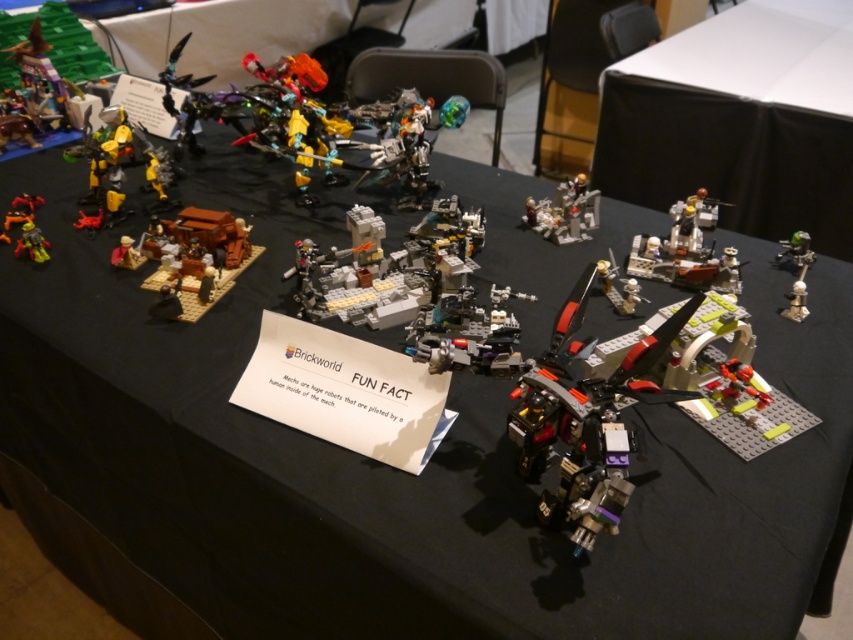
Question: Can you confirm if brown matte building at center is bigger than matte black minifigure at lower left?

Choices:
 (A) yes
 (B) no

Answer: (A)

Question: Which is farther from the metallic gold armor at center?

Choices:
 (A) brown matte building at center
 (B) metallic silver robot at center
 (C) metallic silver mech at center-right

Answer: (C)

Question: Which point is farther to the camera?

Choices:
 (A) matte black minifigure at lower left
 (B) metallic gold armor at center
 (C) green metallic sword at upper right

Answer: (A)

Question: Can you confirm if metallic silver mech at center-right is smaller than matte black minifigure at lower left?

Choices:
 (A) no
 (B) yes

Answer: (A)

Question: Among these objects, which one is farthest from the camera?

Choices:
 (A) metallic silver robot at center
 (B) metallic gold armor at center

Answer: (A)

Question: Does metallic silver mech at center-right appear over matte black minifigure at lower left?

Choices:
 (A) yes
 (B) no

Answer: (B)